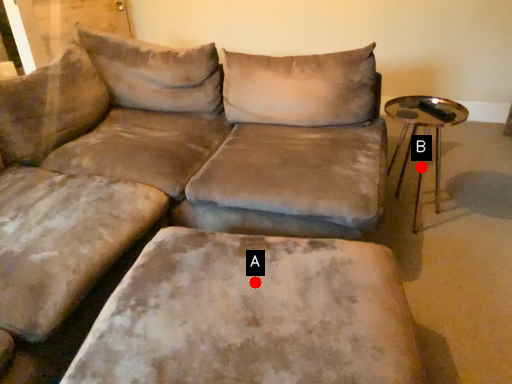
Question: Two points are circled on the image, labeled by A and B beside each circle. Which point is farther from the camera taking this photo?

Choices:
 (A) A is further
 (B) B is further

Answer: (B)